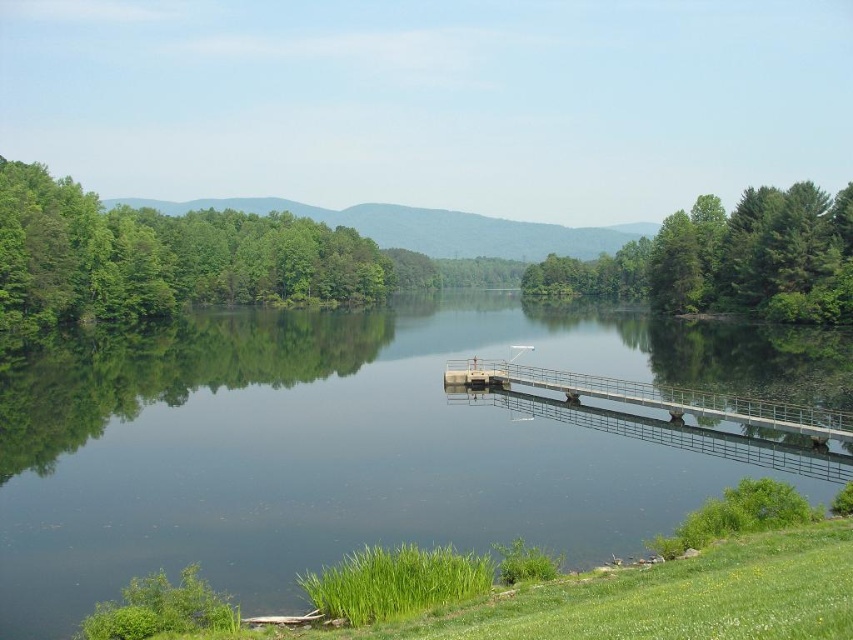
Question: Does green leafy tree at right appear on the right side of metallic gray bridge at center?

Choices:
 (A) yes
 (B) no

Answer: (A)

Question: Based on their relative distances, which object is farther from the clear glass water at center?

Choices:
 (A) metallic gray bridge at center
 (B) green leafy tree at right

Answer: (B)

Question: Is clear glass water at center closer to the viewer compared to metallic gray bridge at center?

Choices:
 (A) no
 (B) yes

Answer: (B)

Question: Which of these objects is positioned farthest from the green leafy tree at right?

Choices:
 (A) clear glass water at center
 (B) metallic gray bridge at center

Answer: (B)

Question: Can you confirm if clear glass water at center is wider than metallic gray bridge at center?

Choices:
 (A) yes
 (B) no

Answer: (A)

Question: Which object appears farthest from the camera in this image?

Choices:
 (A) green leafy tree at right
 (B) metallic gray bridge at center
 (C) clear glass water at center

Answer: (A)